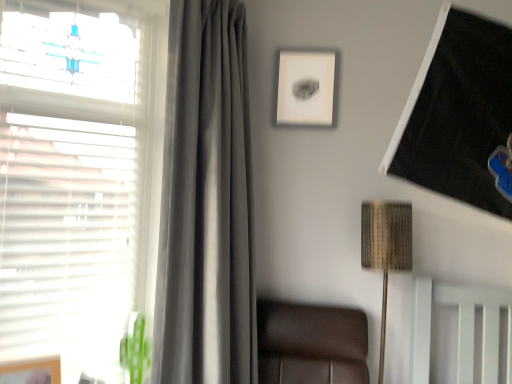
Question: Should I look upward or downward to see white matte window at left?

Choices:
 (A) up
 (B) down

Answer: (A)

Question: In which direction should I rotate to look at matte white picture frame at upper center, which is counted as the second picture frame, starting from the bottom?

Choices:
 (A) left
 (B) right

Answer: (B)

Question: Can you confirm if matte white picture frame at upper center, which is counted as the second picture frame, starting from the bottom, is wider than satin gray curtain at left?

Choices:
 (A) no
 (B) yes

Answer: (A)

Question: Is matte white picture frame at upper center, the 2th picture frame from the front, smaller than satin gray curtain at left?

Choices:
 (A) yes
 (B) no

Answer: (A)

Question: Is matte white picture frame at upper center, acting as the 2th picture frame starting from the left, bigger than satin gray curtain at left?

Choices:
 (A) no
 (B) yes

Answer: (A)

Question: Considering the relative sizes of matte white picture frame at upper center, placed as the first picture frame when sorted from right to left, and satin gray curtain at left in the image provided, is matte white picture frame at upper center, placed as the first picture frame when sorted from right to left, shorter than satin gray curtain at left?

Choices:
 (A) yes
 (B) no

Answer: (A)

Question: From the image's perspective, does matte white picture frame at upper center, which is counted as the second picture frame, starting from the bottom, appear lower than satin gray curtain at left?

Choices:
 (A) no
 (B) yes

Answer: (A)

Question: Is satin gray curtain at left inside matte white picture frame at upper center, which ranks as the 1th picture frame in top-to-bottom order?

Choices:
 (A) yes
 (B) no

Answer: (B)

Question: Is satin gray curtain at left not close to wooden picture frame at lower left, the second picture frame positioned from the right?

Choices:
 (A) no
 (B) yes

Answer: (A)

Question: Considering the relative sizes of satin gray curtain at left and wooden picture frame at lower left, the second picture frame positioned from the right, in the image provided, is satin gray curtain at left smaller than wooden picture frame at lower left, the second picture frame positioned from the right,?

Choices:
 (A) no
 (B) yes

Answer: (A)

Question: From a real-world perspective, is satin gray curtain at left positioned over wooden picture frame at lower left, the second picture frame positioned from the right, based on gravity?

Choices:
 (A) no
 (B) yes

Answer: (B)

Question: Are satin gray curtain at left and wooden picture frame at lower left, the 1th picture frame ordered from the bottom, making contact?

Choices:
 (A) no
 (B) yes

Answer: (A)

Question: Is satin gray curtain at left at the left side of wooden picture frame at lower left, acting as the first picture frame starting from the front?

Choices:
 (A) yes
 (B) no

Answer: (B)

Question: From the image's perspective, does satin gray curtain at left appear lower than wooden picture frame at lower left, the second picture frame positioned from the right?

Choices:
 (A) yes
 (B) no

Answer: (B)

Question: Would you say white matte window at left is part of satin gray curtain at left's contents?

Choices:
 (A) yes
 (B) no

Answer: (B)